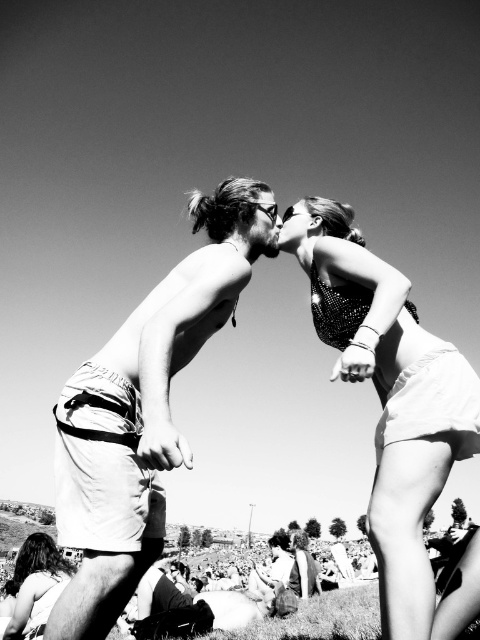
Measure the distance between light beige shorts at center and camera.

A distance of 11.63 feet exists between light beige shorts at center and camera.

Which is in front, point (205, 285) or point (301, 566)?

Point (205, 285)

Find the location of a particular element. light beige shorts at center is located at coordinates (144, 410).

Can you confirm if light beige shorts at center is positioned above sparkly sequin top at upper right?

Yes, light beige shorts at center is above sparkly sequin top at upper right.

Is light beige shorts at center to the left of sparkly sequin top at upper right from the viewer's perspective?

Indeed, light beige shorts at center is positioned on the left side of sparkly sequin top at upper right.

Image resolution: width=480 pixels, height=640 pixels. Find the location of `light beige shorts at center`. light beige shorts at center is located at coordinates (144, 410).

Can you confirm if light beige shorts at center is positioned to the left of dark hair at lower left?

In fact, light beige shorts at center is to the right of dark hair at lower left.

Is light beige shorts at center smaller than dark hair at lower left?

Indeed, light beige shorts at center has a smaller size compared to dark hair at lower left.

Is point (99, 614) less distant than point (27, 604)?

Yes, point (99, 614) is in front of point (27, 604).

Where is `light beige shorts at center`? Image resolution: width=480 pixels, height=640 pixels. light beige shorts at center is located at coordinates (144, 410).